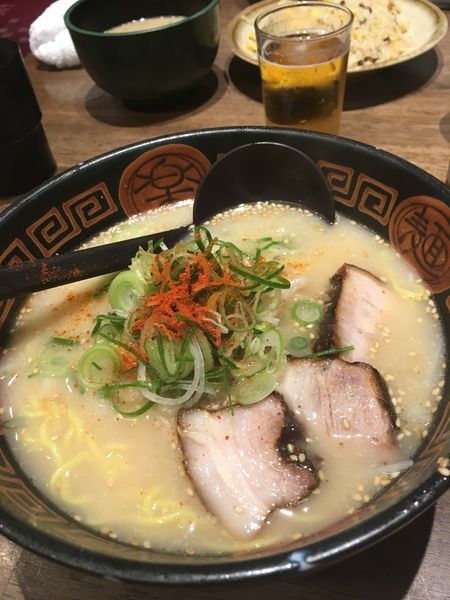
Find the location of a particular element. Image resolution: width=450 pixels, height=600 pixels. picture of food on table is located at coordinates (16, 14), (429, 15), (419, 552), (27, 566).